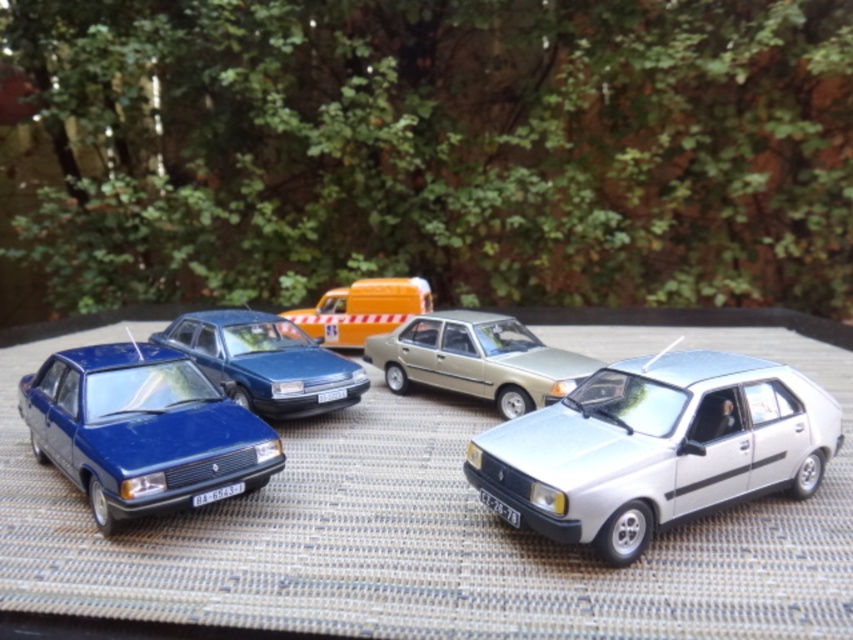
You are a delivery person trying to park your vehicle in a tight space. You have two options in the image, a glossy blue sedan at center and a yellow matte van at center. Which vehicle would require more space to park?

The glossy blue sedan at center is larger in size compared to the yellow matte van at center, so it would require more space to park.

You are a delivery person who needs to park your vehicle in a parking spot that is exactly 2 meters wide. You have two options in the image, the glossy blue sedan at center and the yellow matte van at center. Which vehicle would fit better in the parking spot?

The glossy blue sedan at center has a greater width than the yellow matte van at center. Since the parking spot is exactly 2 meters wide, the yellow matte van at center would fit better as it is narrower than the glossy blue sedan at center.